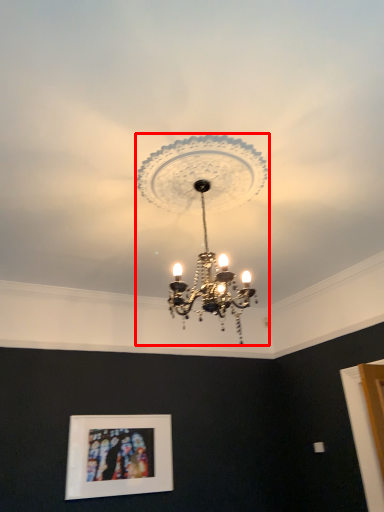
Question: Where is lamp (annotated by the red box) located in relation to picture frame in the image?

Choices:
 (A) right
 (B) left

Answer: (A)